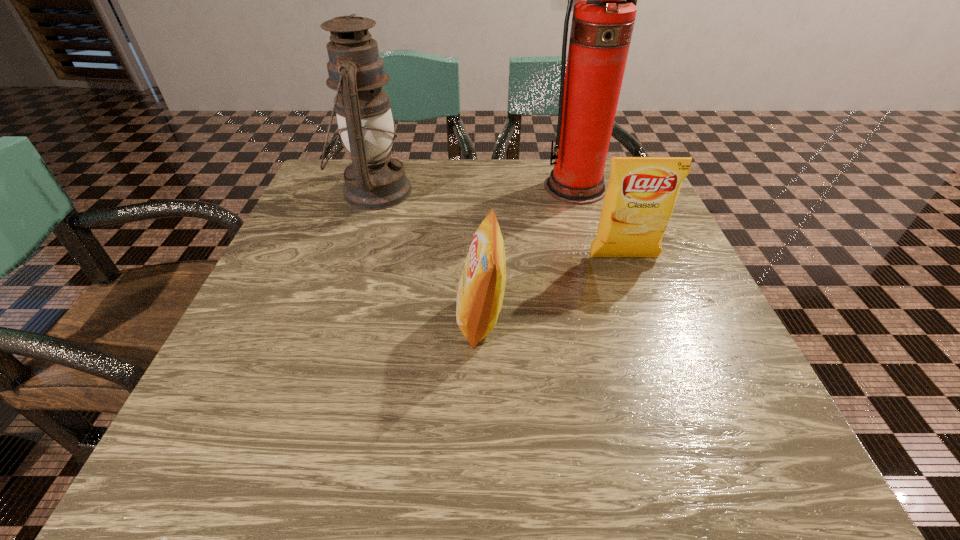
The height and width of the screenshot is (540, 960). What are the coordinates of `free spot that satisfies the following two spatial constraints: 1. at the discharge end of the tallest object; 2. on the front-facing side of the third object from right to left` in the screenshot? It's located at (613, 318).

Find the location of a particular element. The image size is (960, 540). vacant position in the image that satisfies the following two spatial constraints: 1. at the discharge end of the tallest object; 2. on the front-facing side of the third object from right to left is located at coordinates (613, 318).